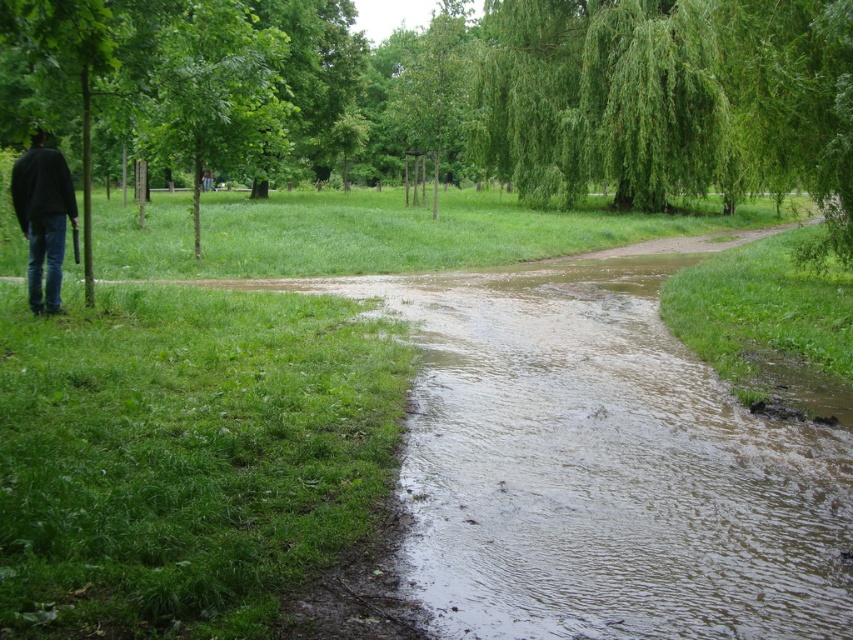
You are a hiker who needs to decide whether to walk around the muddy path. You see a green leafy tree at left and a black matte jacket at left. Which object is bigger and might provide better shelter from the rain?

The green leafy tree at left is larger in size than the black matte jacket at left, so it would provide better shelter from the rain.

You are a hiker who wants to take a photo of the green leafy tree at left and the black matte jacket at left. Which object should you focus on first if you want to capture both in a single frame without moving the camera?

The green leafy tree at left is much taller than the black matte jacket at left, so you should focus on the tree first to ensure it fits entirely within the frame before adjusting for the jacket.

You are a hiker trying to find your way back to the trailhead. You see a green leafy tree at left and a black matte jacket at left. Which object is closer to the trailhead if the trailhead is located to the right of the image?

The green leafy tree at left is positioned on the right side of black matte jacket at left, so the green leafy tree at left is closer to the trailhead located to the right of the image.